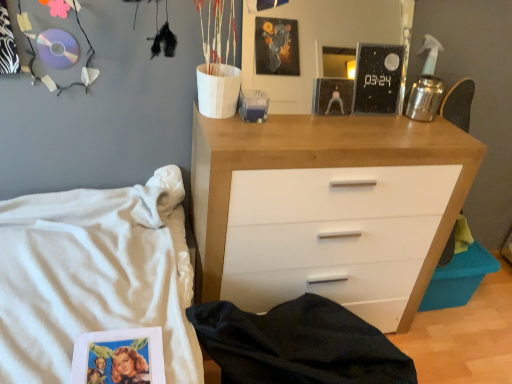
Identify the location of white cotton bed at lower left. (94, 276).

Describe the element at coordinates (377, 79) in the screenshot. The width and height of the screenshot is (512, 384). I see `black glossy clock at upper center` at that location.

Where is `white wood chest of drawers at center`? This screenshot has width=512, height=384. white wood chest of drawers at center is located at coordinates (327, 207).

Where is `white cotton bed at lower left`? white cotton bed at lower left is located at coordinates (94, 276).

Is white cotton bed at lower left oriented away from white wood chest of drawers at center?

No, white cotton bed at lower left is not facing the opposite direction of white wood chest of drawers at center.

Can you confirm if white cotton bed at lower left is thinner than white wood chest of drawers at center?

No, white cotton bed at lower left is not thinner than white wood chest of drawers at center.

Is point (70, 198) behind point (298, 159)?

That is True.

Measure the distance between white cotton bed at lower left and white wood chest of drawers at center.

white cotton bed at lower left and white wood chest of drawers at center are 19.17 inches apart.

Is the depth of black glossy clock at upper center greater than that of white wood chest of drawers at center?

Yes, the depth of black glossy clock at upper center is greater than that of white wood chest of drawers at center.

Are black glossy clock at upper center and white wood chest of drawers at center far apart?

No, black glossy clock at upper center is not far away from white wood chest of drawers at center.

Which is more to the right, black glossy clock at upper center or white wood chest of drawers at center?

Positioned to the right is black glossy clock at upper center.

Locate an element on the screen. The width and height of the screenshot is (512, 384). chest of drawers below the black glossy clock at upper center (from a real-world perspective) is located at coordinates (327, 207).

Is point (318, 220) closer or farther from the camera than point (375, 80)?

Point (318, 220) is closer to the camera than point (375, 80).

Considering the relative positions of white wood chest of drawers at center and black glossy clock at upper center in the image provided, is white wood chest of drawers at center to the left or to the right of black glossy clock at upper center?

white wood chest of drawers at center is positioned on black glossy clock at upper center's left side.

Is white wood chest of drawers at center in contact with black glossy clock at upper center?

No, white wood chest of drawers at center is not making contact with black glossy clock at upper center.

What's the angular difference between white wood chest of drawers at center and black glossy clock at upper center's facing directions?

white wood chest of drawers at center and black glossy clock at upper center are facing 2.06 degrees away from each other.

Can you tell me how much white wood chest of drawers at center and white cotton bed at lower left differ in facing direction?

white wood chest of drawers at center and white cotton bed at lower left are facing 90 degrees away from each other.

From their relative heights in the image, would you say white wood chest of drawers at center is taller or shorter than white cotton bed at lower left?

Clearly, white wood chest of drawers at center is taller compared to white cotton bed at lower left.

Considering the relative sizes of white wood chest of drawers at center and white cotton bed at lower left in the image provided, is white wood chest of drawers at center thinner than white cotton bed at lower left?

Correct, the width of white wood chest of drawers at center is less than that of white cotton bed at lower left.

Can you see white wood chest of drawers at center touching white cotton bed at lower left?

There is a gap between white wood chest of drawers at center and white cotton bed at lower left.

In the scene shown: From the image's perspective, is black glossy clock at upper center located beneath white cotton bed at lower left?

Incorrect, from the image's perspective, black glossy clock at upper center is higher than white cotton bed at lower left.

From a real-world perspective, who is located lower, black glossy clock at upper center or white cotton bed at lower left?

white cotton bed at lower left.

Does white cotton bed at lower left turn towards black glossy clock at upper center?

Yes, white cotton bed at lower left is aimed at black glossy clock at upper center.

Locate an element on the screen. The width and height of the screenshot is (512, 384). magazine behind the white cotton bed at lower left is located at coordinates (377, 79).

In the scene shown: What's the angular difference between white cotton bed at lower left and black glossy clock at upper center's facing directions?

The facing directions of white cotton bed at lower left and black glossy clock at upper center are 88 degrees apart.

Considering the sizes of objects white cotton bed at lower left and black glossy clock at upper center in the image provided, who is smaller, white cotton bed at lower left or black glossy clock at upper center?

black glossy clock at upper center.

Locate an element on the screen. The height and width of the screenshot is (384, 512). bed in front of the white wood chest of drawers at center is located at coordinates (94, 276).

The width and height of the screenshot is (512, 384). In order to click on magazine behind the white wood chest of drawers at center in this screenshot , I will do `click(377, 79)`.

From the image, which object appears to be farther from white cotton bed at lower left, white wood chest of drawers at center or black glossy clock at upper center?

black glossy clock at upper center is further to white cotton bed at lower left.

Based on their spatial positions, is black glossy clock at upper center or white wood chest of drawers at center closer to white cotton bed at lower left?

white wood chest of drawers at center is closer to white cotton bed at lower left.

Which object lies nearer to the anchor point black glossy clock at upper center, white wood chest of drawers at center or white cotton bed at lower left?

white wood chest of drawers at center.

When comparing their distances from black glossy clock at upper center, does white cotton bed at lower left or white wood chest of drawers at center seem closer?

Based on the image, white wood chest of drawers at center appears to be nearer to black glossy clock at upper center.

Considering their positions, is black glossy clock at upper center positioned closer to white wood chest of drawers at center than white cotton bed at lower left?

The object closer to white wood chest of drawers at center is black glossy clock at upper center.

Estimate the real-world distances between objects in this image. Which object is closer to white wood chest of drawers at center, white cotton bed at lower left or black glossy clock at upper center?

black glossy clock at upper center.

This screenshot has width=512, height=384. Find the location of `chest of drawers between white cotton bed at lower left and black glossy clock at upper center`. chest of drawers between white cotton bed at lower left and black glossy clock at upper center is located at coordinates (327, 207).